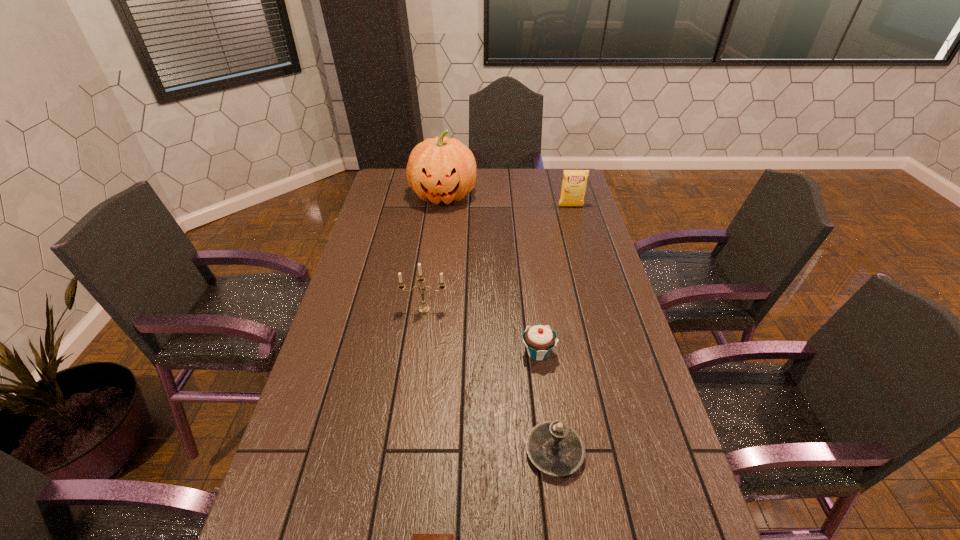
I want to click on vacant space at the far left corner, so click(x=392, y=174).

Where is `unoccupied area between the crisp (potato chip) and the left candle`? The height and width of the screenshot is (540, 960). unoccupied area between the crisp (potato chip) and the left candle is located at coordinates (497, 258).

Locate an element on the screen. Image resolution: width=960 pixels, height=540 pixels. vacant region between the farther candle and the nearer candle is located at coordinates (490, 380).

What are the coordinates of `free space between the tallest object and the shorter candle` in the screenshot? It's located at (499, 324).

This screenshot has width=960, height=540. In order to click on unoccupied position between the rightmost object and the tallest object in this screenshot , I will do `click(507, 201)`.

This screenshot has width=960, height=540. In order to click on unoccupied area between the third nearest object and the pumpkin in this screenshot , I will do `click(491, 274)`.

The image size is (960, 540). I want to click on free space between the nearer candle and the cupcake, so click(546, 402).

Identify the location of vacant area that lies between the shorter candle and the cupcake. The width and height of the screenshot is (960, 540). (546, 402).

Where is `object that ranks as the fifth closest to the crisp (potato chip)`? object that ranks as the fifth closest to the crisp (potato chip) is located at coordinates (417, 539).

Locate an element on the screen. the fifth closest object to the cupcake is located at coordinates (574, 182).